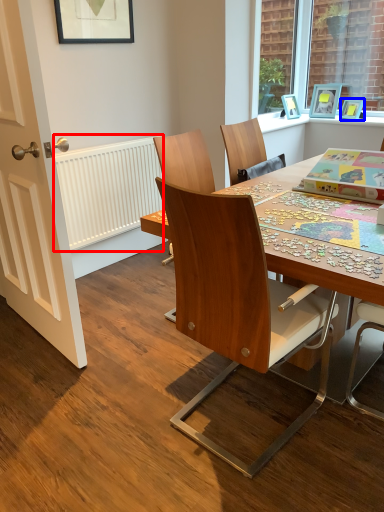
Question: Which of the following is the farthest to the observer, radiator (highlighted by a red box) or picture frame (highlighted by a blue box)?

Choices:
 (A) radiator
 (B) picture frame

Answer: (B)